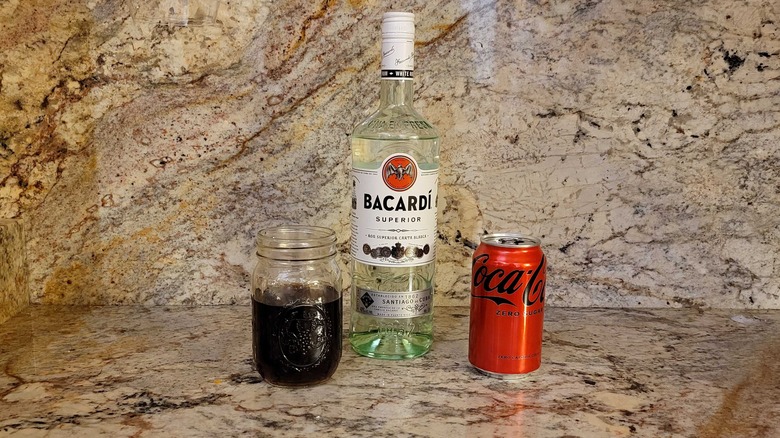
Find the location of `marble`. marble is located at coordinates (608, 335).